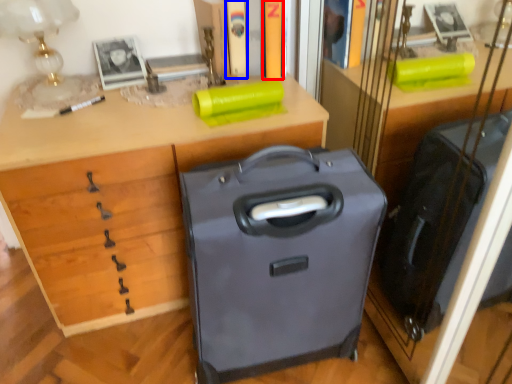
Question: Among these objects, which one is farthest to the camera, book (highlighted by a red box) or book (highlighted by a blue box)?

Choices:
 (A) book
 (B) book

Answer: (B)